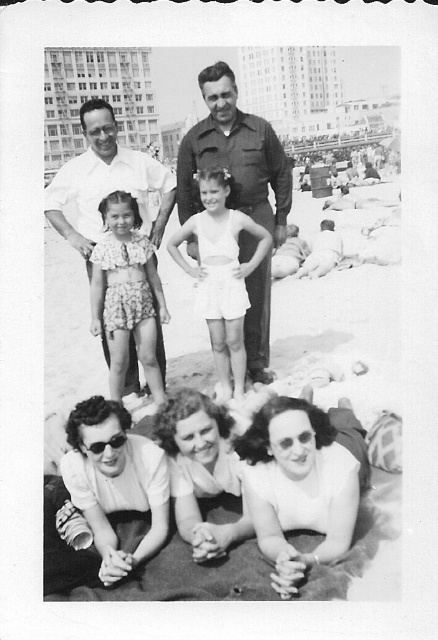
Question: Is matte white swimsuit at lower center smaller than white cotton shirt at upper left?

Choices:
 (A) yes
 (B) no

Answer: (A)

Question: Can you confirm if matte white swimsuit at lower center is thinner than white cotton shirt at upper left?

Choices:
 (A) yes
 (B) no

Answer: (A)

Question: Which point is closer to the camera?

Choices:
 (A) dark green uniform at center
 (B) white cotton shirt at upper left

Answer: (B)

Question: Which of the following is the farthest from the observer?

Choices:
 (A) dark green uniform at center
 (B) floral fabric swimsuit at center
 (C) white cotton shirt at upper left

Answer: (A)

Question: Can you confirm if dark green uniform at center is positioned below white cotton shirt at upper left?

Choices:
 (A) yes
 (B) no

Answer: (A)

Question: Which point appears closest to the camera in this image?

Choices:
 (A) (158, 177)
 (B) (116, 292)

Answer: (B)